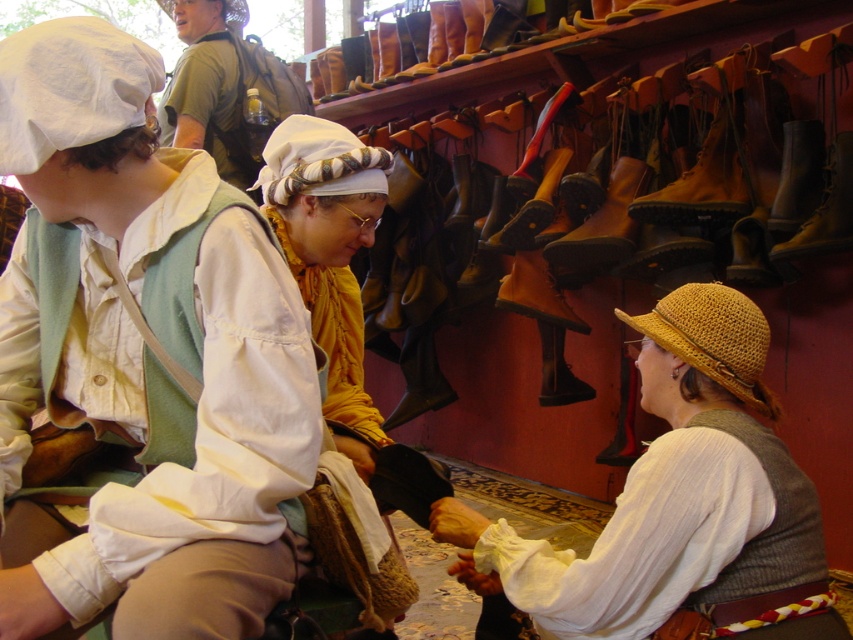
Can you confirm if matte straw hat at upper right is smaller than white woven hat at center?

No.

Where is `matte straw hat at upper right`? The height and width of the screenshot is (640, 853). matte straw hat at upper right is located at coordinates (141, 362).

Identify the location of matte straw hat at upper right. (141, 362).

Is straw hat at center shorter than white woven hat at center?

Incorrect, straw hat at center's height does not fall short of white woven hat at center's.

Can you confirm if straw hat at center is positioned below white woven hat at center?

Indeed, straw hat at center is positioned under white woven hat at center.

Which is behind, point (647, 346) or point (314, 193)?

The point (314, 193) is more distant.

The width and height of the screenshot is (853, 640). I want to click on straw hat at center, so click(672, 496).

Which is in front, point (688, 317) or point (287, 170)?

Point (688, 317)

Is the position of golden straw hat at lower right less distant than that of white woven hat at center?

Yes, it is in front of white woven hat at center.

Who is more distant from viewer, (x=753, y=326) or (x=360, y=186)?

The point (x=360, y=186) is more distant.

I want to click on golden straw hat at lower right, so click(712, 339).